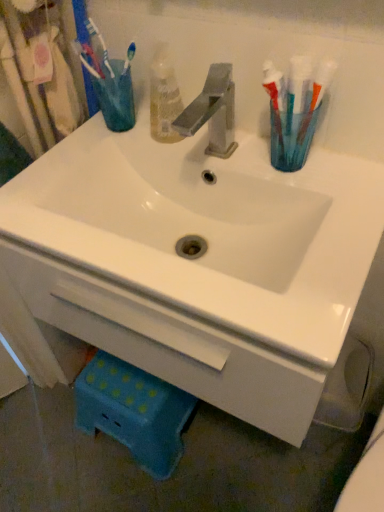
This screenshot has width=384, height=512. In order to click on free space in front of translucent plastic cup at upper left, arranged as the 1th turquoise when viewed from the top in this screenshot , I will do `click(94, 157)`.